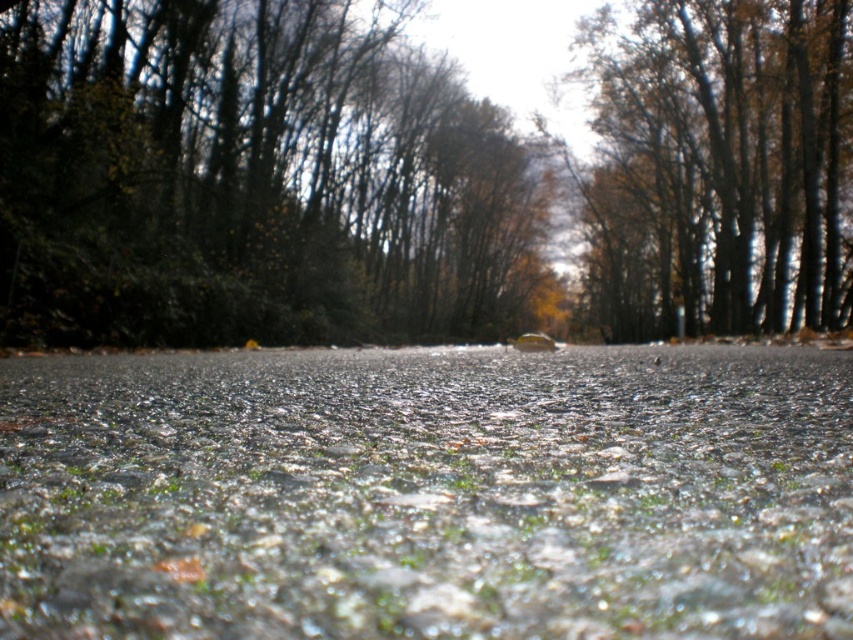
You are standing on the road and looking towards the trees. Which tree, the dark green leafy tree at center or the brown wood tree at upper right, is taller?

The brown wood tree at upper right is taller than the dark green leafy tree at center.

You are a photographer trying to capture a wide shot of the road. You want to ensure both the dark green leafy tree at center and the brown wood tree at upper right are fully visible in your frame. Based on their widths, which tree might require you to adjust your camera angle to avoid cropping?

The dark green leafy tree at center might be wider than the brown wood tree at upper right, so it might require adjusting the camera angle to avoid cropping.